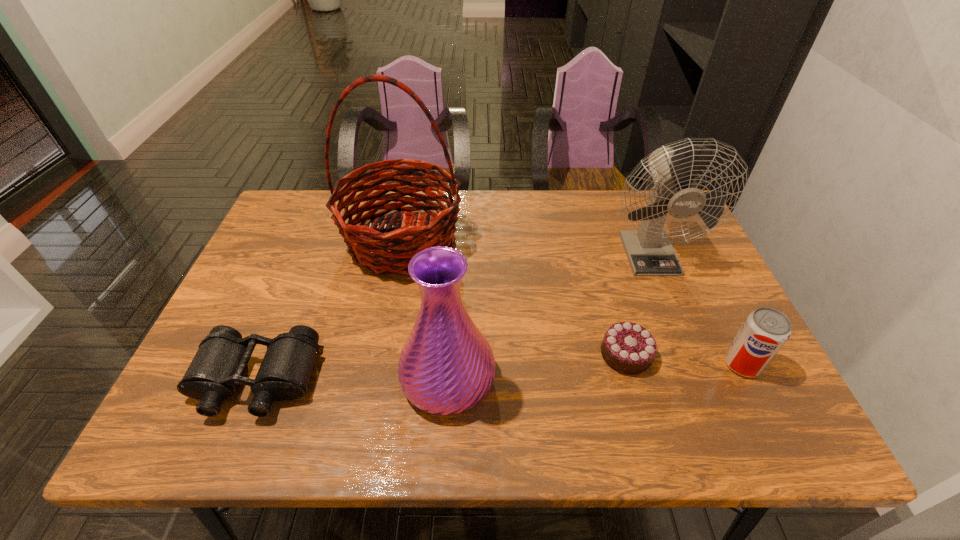
At what (x,y) coordinates should I click in order to perform the action: click on free spot between the chocolate cake and the soda. Please return your answer as a coordinate pair (x, y). The width and height of the screenshot is (960, 540). Looking at the image, I should click on (684, 359).

I want to click on blank region between the fan and the vase, so click(548, 315).

Identify the location of the third closest object relative to the second shortest object. (628, 348).

The image size is (960, 540). I want to click on object that is the fourth closest to the third shortest object, so (x=369, y=245).

Where is `free spot that satisfies the following two spatial constraints: 1. on the air flow direction of the soda; 2. on the left side of the fan`? free spot that satisfies the following two spatial constraints: 1. on the air flow direction of the soda; 2. on the left side of the fan is located at coordinates (693, 364).

The image size is (960, 540). In order to click on vacant space that satisfies the following two spatial constraints: 1. on the air flow direction of the fourth tallest object; 2. on the left side of the fan in this screenshot , I will do `click(693, 364)`.